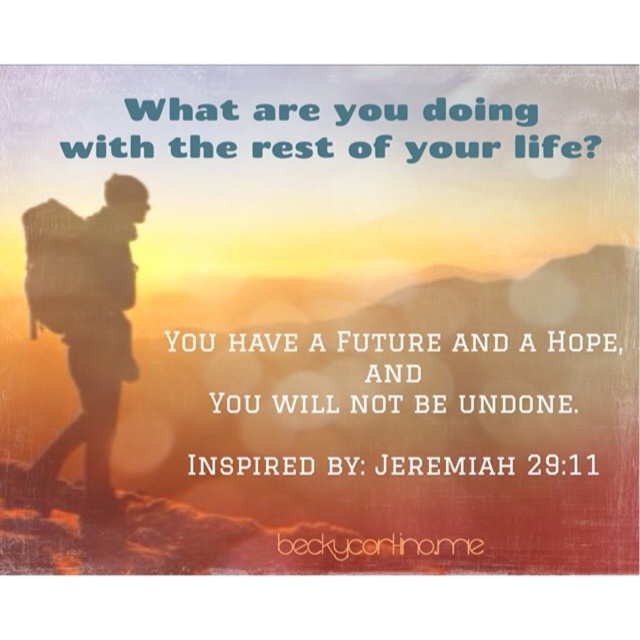
Question: Which object appears closest to the camera in this image?

Choices:
 (A) white paper text at center
 (B) blue text at upper center

Answer: (A)

Question: Which object is farther from the camera taking this photo?

Choices:
 (A) silhouette backpack at left
 (B) blue text at upper center
 (C) white paper text at center

Answer: (B)

Question: Which object is positioned farthest from the white paper text at center?

Choices:
 (A) blue text at upper center
 (B) silhouette backpack at left

Answer: (A)

Question: In this image, where is silhouette backpack at left located relative to blue text at upper center?

Choices:
 (A) below
 (B) above

Answer: (A)

Question: Can you confirm if silhouette backpack at left is positioned below blue text at upper center?

Choices:
 (A) no
 (B) yes

Answer: (B)

Question: Is silhouette backpack at left further to camera compared to white paper text at center?

Choices:
 (A) no
 (B) yes

Answer: (A)